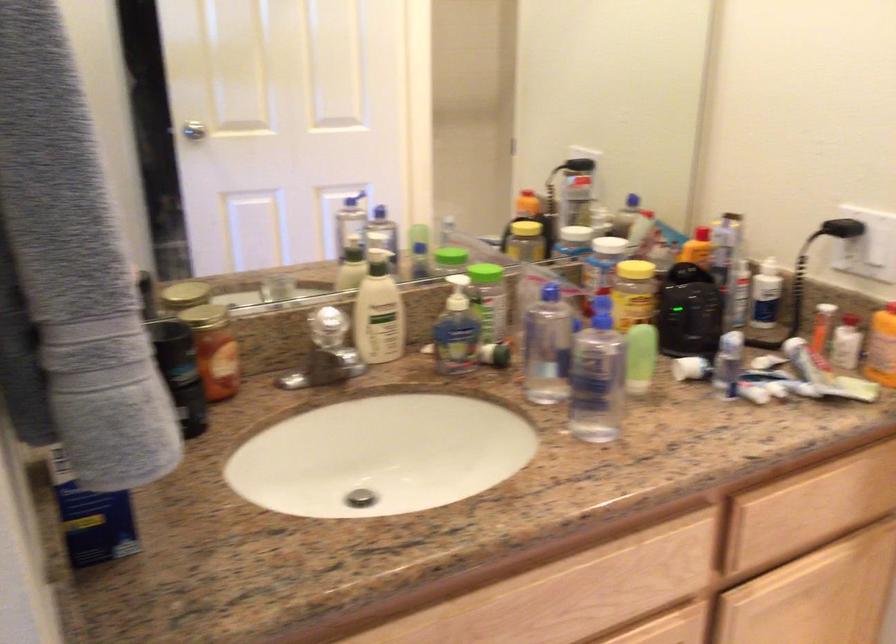
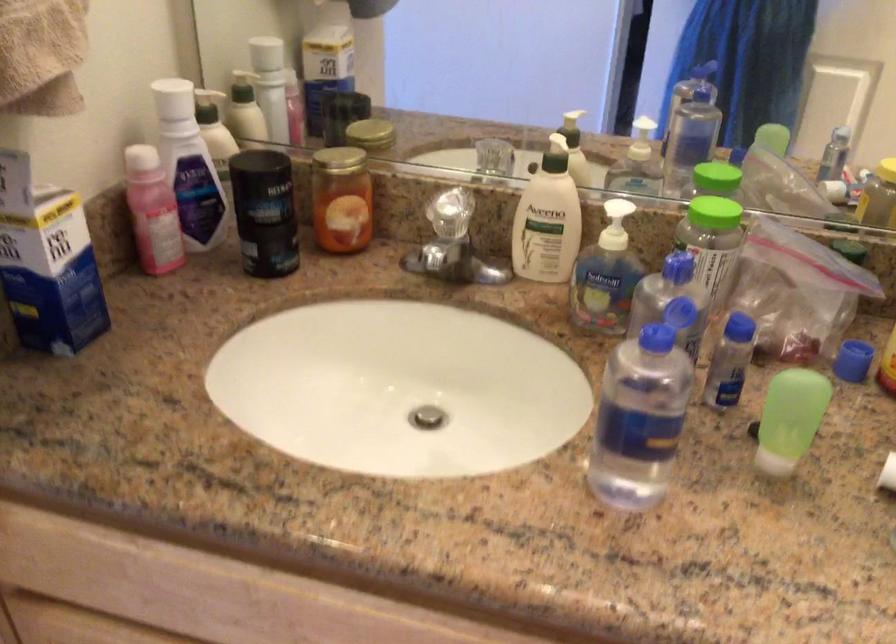
The point at (194, 372) is marked in the first image. Where is the corresponding point in the second image?

(264, 212)